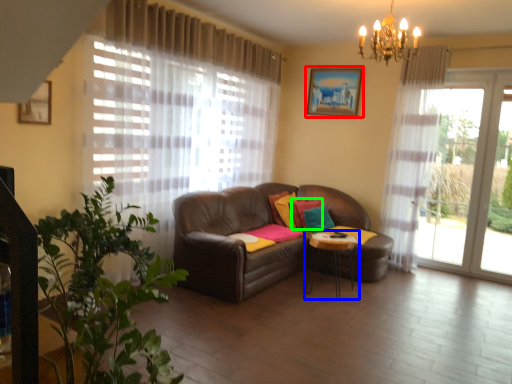
Question: Which is nearer to the picture frame (highlighted by a red box)? table (highlighted by a blue box) or pillow (highlighted by a green box).

Choices:
 (A) table
 (B) pillow

Answer: (B)